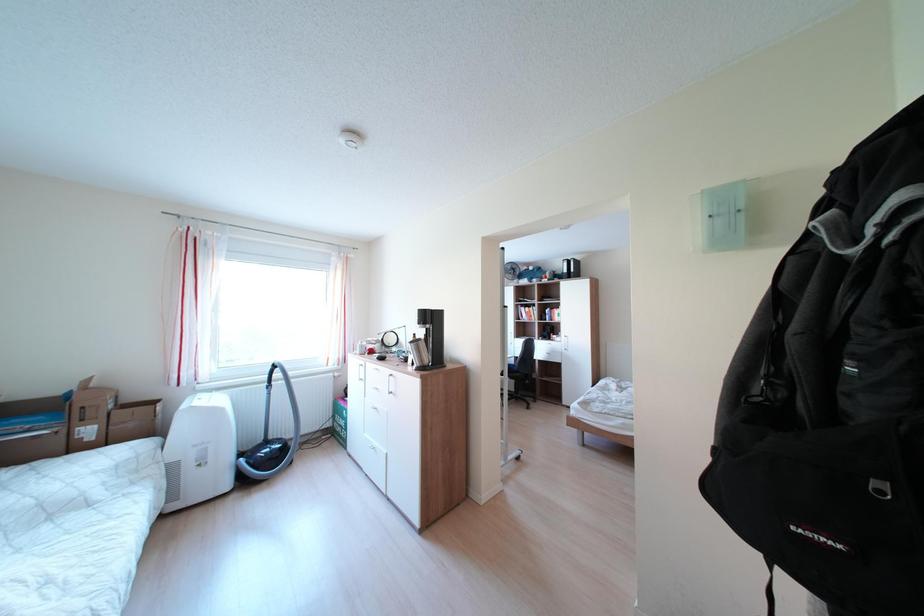
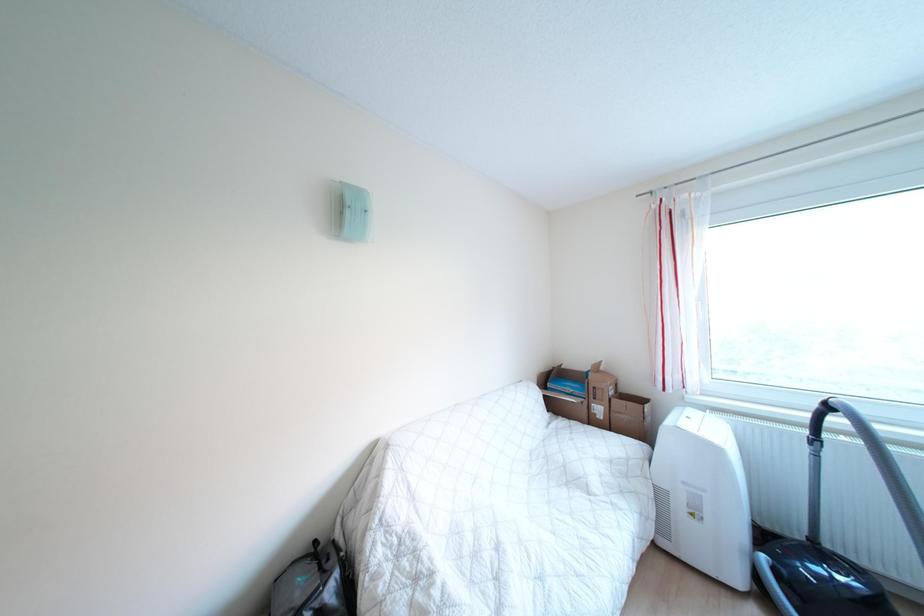
Question: The camera is either moving clockwise (left) or counter-clockwise (right) around the object. The first image is from the beginning of the video and the second image is from the end. Is the camera moving left or right when shooting the video?

Choices:
 (A) Left
 (B) Right

Answer: (B)